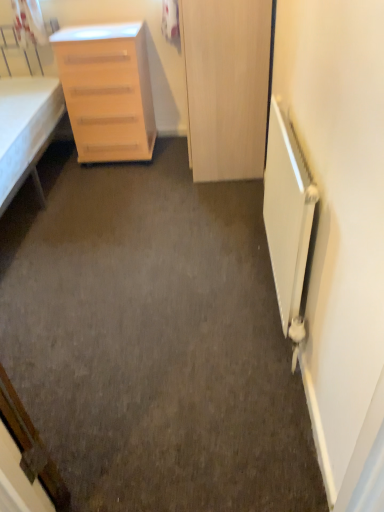
Measure the distance between point (259, 97) and camera.

Point (259, 97) is 2.34 meters away from camera.

What are the coordinates of `light wood/finely finished chest of drawers at left` in the screenshot? It's located at (107, 91).

Based on the photo, looking at the image, does white matte radiator at right seem bigger or smaller compared to wooden door at center?

Considering their sizes, white matte radiator at right takes up less space than wooden door at center.

Is white matte radiator at right facing away from wooden door at center?

No, white matte radiator at right's orientation is not away from wooden door at center.

Is wooden door at center located within white matte radiator at right?

No.

In the scene shown: Is the surface of white matte radiator at right in direct contact with wooden door at center?

No, white matte radiator at right is not with wooden door at center.

How much distance is there between white matte radiator at right and white fabric bed at left?

They are 4.68 feet apart.

In the scene shown: Is white matte radiator at right surrounding white fabric bed at left?

No, white fabric bed at left is not a part of white matte radiator at right.

Between white matte radiator at right and white fabric bed at left, which one appears on the right side from the viewer's perspective?

white matte radiator at right.

What's the angular difference between white matte radiator at right and white fabric bed at left's facing directions?

A: The facing directions of white matte radiator at right and white fabric bed at left are 91.8 degrees apart.

Is the depth of white fabric bed at left greater than that of wooden door at center?

No, white fabric bed at left is in front of wooden door at center.

Is white fabric bed at left shorter than wooden door at center?

Yes.

Is white fabric bed at left next to wooden door at center and touching it?

No, white fabric bed at left is not beside wooden door at center.

What's the angular difference between white fabric bed at left and wooden door at center's facing directions?

They differ by 90 degrees in their facing directions.

Is wooden door at center aimed at light wood/finely finished chest of drawers at left?

Yes, wooden door at center is turned towards light wood/finely finished chest of drawers at left.

Which object is closer to the camera, wooden door at center or light wood/finely finished chest of drawers at left?

wooden door at center is closer to the camera.

From the image's perspective, which is above, wooden door at center or light wood/finely finished chest of drawers at left?

From the image's view, wooden door at center is above.

Can we say wooden door at center lies outside light wood/finely finished chest of drawers at left?

Absolutely, wooden door at center is external to light wood/finely finished chest of drawers at left.

In the image, is wooden door at center on the left side or the right side of white matte radiator at right?

wooden door at center is positioned on white matte radiator at right's left side.

Does wooden door at center have a smaller size compared to white matte radiator at right?

No.

Does wooden door at center have a greater width compared to white matte radiator at right?

Indeed, wooden door at center has a greater width compared to white matte radiator at right.

Is light wood/finely finished chest of drawers at left situated inside wooden door at center or outside?

light wood/finely finished chest of drawers at left exists outside the volume of wooden door at center.

The width and height of the screenshot is (384, 512). Find the location of `door above the light wood/finely finished chest of drawers at left (from a real-world perspective)`. door above the light wood/finely finished chest of drawers at left (from a real-world perspective) is located at coordinates (226, 86).

From the image's perspective, which object appears higher, light wood/finely finished chest of drawers at left or wooden door at center?

wooden door at center.

From the image's perspective, is white matte radiator at right on top of light wood/finely finished chest of drawers at left?

Incorrect, from the image's perspective, white matte radiator at right is lower than light wood/finely finished chest of drawers at left.

Can you confirm if white matte radiator at right is shorter than light wood/finely finished chest of drawers at left?

Yes, white matte radiator at right is shorter than light wood/finely finished chest of drawers at left.

Locate an element on the screen. The height and width of the screenshot is (512, 384). chest of drawers that appears on the left of white matte radiator at right is located at coordinates (107, 91).

Which of these two, white matte radiator at right or light wood/finely finished chest of drawers at left, is wider?

With larger width is light wood/finely finished chest of drawers at left.

Image resolution: width=384 pixels, height=512 pixels. Identify the location of radiator that is in front of the wooden door at center. (288, 220).

Find the location of `bed on the left of white matte radiator at right`. bed on the left of white matte radiator at right is located at coordinates (25, 123).

When comparing their distances from white fabric bed at left, does white matte radiator at right or wooden door at center seem further?

white matte radiator at right lies further to white fabric bed at left than the other object.

Considering their positions, is white matte radiator at right positioned further to white fabric bed at left than light wood/finely finished chest of drawers at left?

The object further to white fabric bed at left is white matte radiator at right.

Looking at the image, which one is located further to white matte radiator at right, light wood/finely finished chest of drawers at left or wooden door at center?

light wood/finely finished chest of drawers at left.

Based on their spatial positions, is wooden door at center or white matte radiator at right closer to light wood/finely finished chest of drawers at left?

Based on the image, wooden door at center appears to be nearer to light wood/finely finished chest of drawers at left.

Considering their positions, is white matte radiator at right positioned further to wooden door at center than light wood/finely finished chest of drawers at left?

The object further to wooden door at center is white matte radiator at right.

Based on the photo, estimate the real-world distances between objects in this image. Which object is closer to white matte radiator at right, light wood/finely finished chest of drawers at left or white fabric bed at left?

light wood/finely finished chest of drawers at left is closer to white matte radiator at right.

From the image, which object appears to be nearer to white fabric bed at left, light wood/finely finished chest of drawers at left or white matte radiator at right?

Based on the image, light wood/finely finished chest of drawers at left appears to be nearer to white fabric bed at left.

Based on the photo, looking at the image, which one is located closer to white matte radiator at right, wooden door at center or light wood/finely finished chest of drawers at left?

The object closer to white matte radiator at right is wooden door at center.

You are a GUI agent. You are given a task and a screenshot of the screen. Output one action in this format:
    pyautogui.click(x=<x>, y=<y>)
    Task: Click on the chest of drawers situated between white fabric bed at left and wooden door at center from left to right
    This screenshot has height=512, width=384.
    Given the screenshot: What is the action you would take?
    pyautogui.click(x=107, y=91)

This screenshot has height=512, width=384. I want to click on chest of drawers between white fabric bed at left and white matte radiator at right, so click(x=107, y=91).

Where is `door between white matte radiator at right and light wood/finely finished chest of drawers at left in the front-back direction`? Image resolution: width=384 pixels, height=512 pixels. door between white matte radiator at right and light wood/finely finished chest of drawers at left in the front-back direction is located at coordinates (226, 86).

At what (x,y) coordinates should I click in order to perform the action: click on door between white fabric bed at left and white matte radiator at right from left to right. Please return your answer as a coordinate pair (x, y). Looking at the image, I should click on (226, 86).